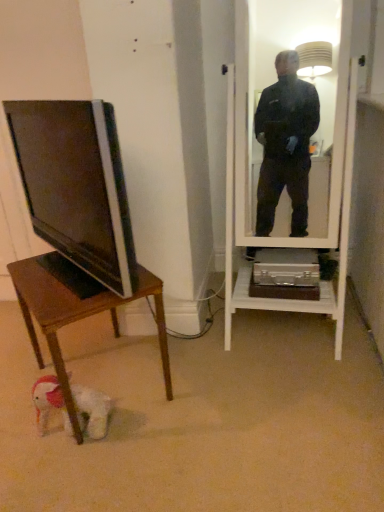
Image resolution: width=384 pixels, height=512 pixels. Find the location of `vacant space to the left of white plush dog at lower left`. vacant space to the left of white plush dog at lower left is located at coordinates (17, 432).